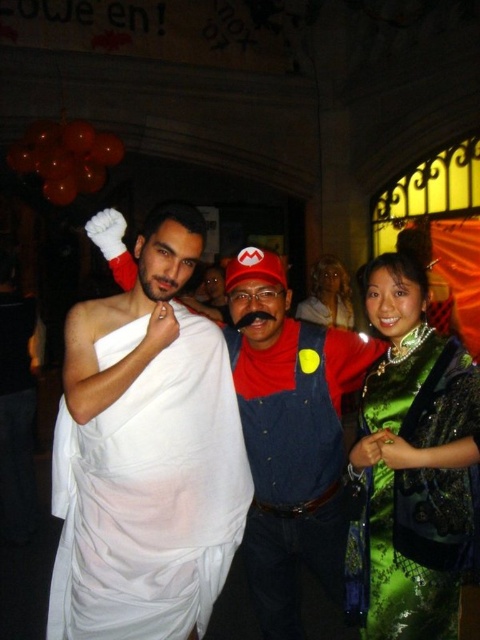
Measure the distance between green satin dress at right and shiny gold necklace at center.

green satin dress at right and shiny gold necklace at center are 8.31 meters apart.

Does green satin dress at right have a greater width compared to shiny gold necklace at center?

Incorrect, green satin dress at right's width does not surpass shiny gold necklace at center's.

You are a GUI agent. You are given a task and a screenshot of the screen. Output one action in this format:
    pyautogui.click(x=<x>, y=<y>)
    Task: Click on the green satin dress at right
    
    Given the screenshot: What is the action you would take?
    pyautogui.click(x=412, y=468)

Which of these two, white cloth at center or green satin dress at right, stands shorter?

green satin dress at right

Is white cloth at center thinner than green satin dress at right?

No, white cloth at center is not thinner than green satin dress at right.

Does point (184, 317) come behind point (466, 449)?

Yes, it is.

Identify the location of white cloth at center. (145, 454).

Who is positioned more to the left, white cloth at center or shiny gold necklace at center?

Positioned to the left is white cloth at center.

Is white cloth at center positioned before shiny gold necklace at center?

That is True.

Does point (193, 584) come farther from viewer compared to point (348, 285)?

No, it is in front of (348, 285).

Locate an element on the screen. The width and height of the screenshot is (480, 640). white cloth at center is located at coordinates (145, 454).